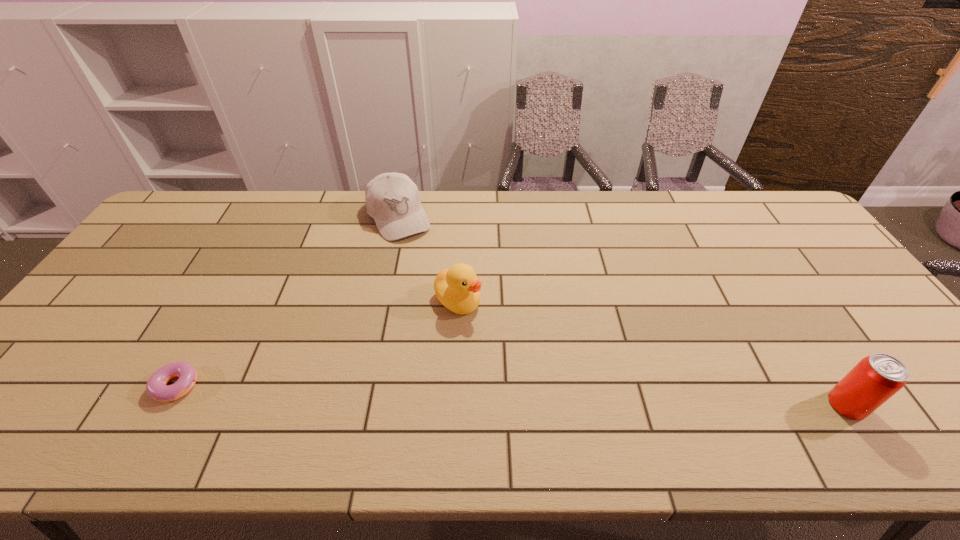
The image size is (960, 540). In order to click on vacant region between the duck and the leftmost object in this screenshot , I will do `click(319, 340)`.

Identify the location of vacant point located between the shortest object and the can. (513, 393).

Find the location of `vacant point located between the shortest object and the baseball cap`. vacant point located between the shortest object and the baseball cap is located at coordinates (289, 299).

Locate an element on the screen. The height and width of the screenshot is (540, 960). free space that is in between the duck and the baseball cap is located at coordinates (429, 258).

This screenshot has height=540, width=960. What are the coordinates of `object that is the third closest one to the rightmost object` in the screenshot? It's located at (156, 387).

Select which object is the second closest to the duck. Please provide its 2D coordinates. Your answer should be formatted as a tuple, i.e. [(x, y)], where the tuple contains the x and y coordinates of a point satisfying the conditions above.

[(156, 387)]

In order to click on free space that satisfies the following two spatial constraints: 1. on the back side of the third nearest object; 2. on the right side of the doughnut in this screenshot , I will do `click(224, 300)`.